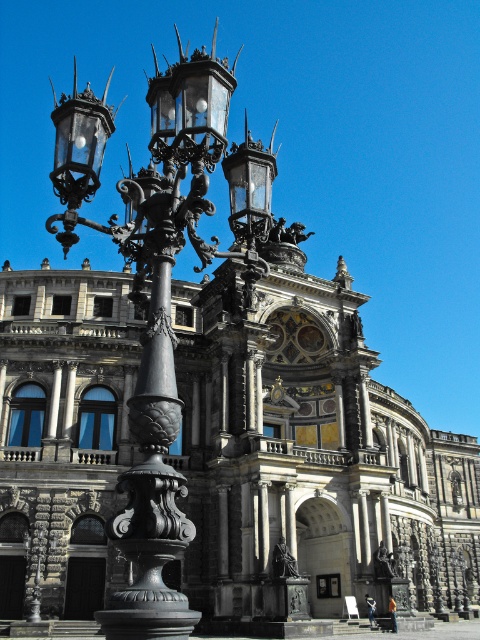
You are a tourist standing in front of the dark gray stone palace at center and want to take a photo of the polished bronze street light at left. Can you see the entire street light without any obstruction from the palace?

The polished bronze street light at left is behind the dark gray stone palace at center, so the palace will block part of the street light in your photo.

You are standing at point (312, 428) and want to reach the entrance of the building. The entrance is located at the central section with the prominent archway. Given that the distance between your current position and the entrance is 76.46 meters, can you estimate how long it would take to walk there at a normal pace of 1.4 meters per second?

The distance between point (312, 428) and the entrance is 76.46 meters. At a normal walking pace of 1.4 meters per second, it would take approximately 54.6 seconds, which is roughly 55 seconds, to reach the entrance.

You are standing in front of the dark gray stone palace at center and want to take a photo that captures the entire building. Considering the camera you have can focus on objects up to 200 feet away, will the palace be in focus?

The dark gray stone palace at center is 187.44 feet away from camera, which is within the camera focus range of 200 feet. Therefore, the palace will be in focus.